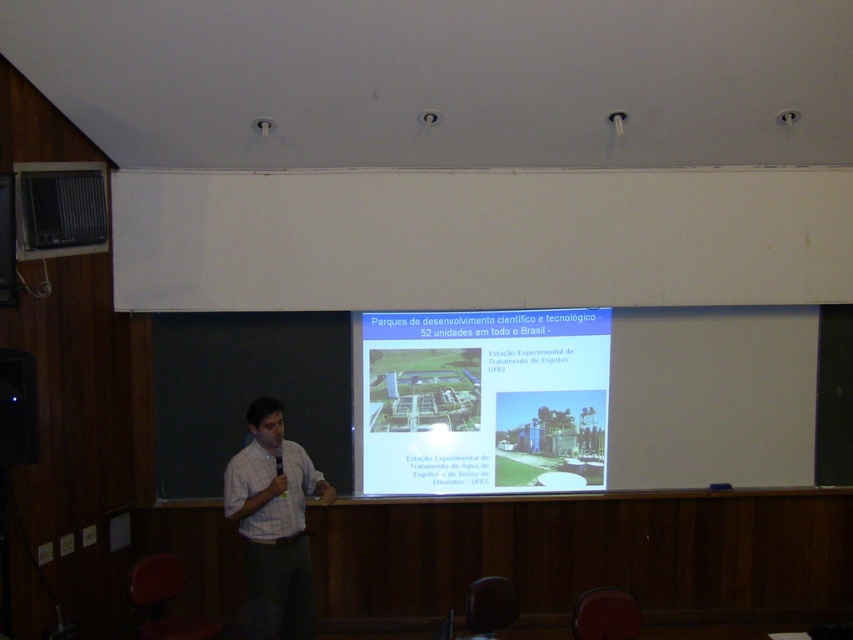
Which is below, matte black shirt at left or white shirt at center?

matte black shirt at left is below.

The image size is (853, 640). Find the location of `matte black shirt at left`. matte black shirt at left is located at coordinates (16, 408).

Does white checkered shirt at center have a lesser height compared to white shirt at center?

No.

Does white checkered shirt at center appear on the left side of white shirt at center?

Incorrect, white checkered shirt at center is not on the left side of white shirt at center.

Measure the distance between white checkered shirt at center and camera.

white checkered shirt at center and camera are 4.48 meters apart from each other.

In order to click on white checkered shirt at center in this screenshot , I will do `click(273, 524)`.

In the scene shown: Is metallic projector at upper left to the left of matte black shirt at left from the viewer's perspective?

Correct, you'll find metallic projector at upper left to the left of matte black shirt at left.

You are a GUI agent. You are given a task and a screenshot of the screen. Output one action in this format:
    pyautogui.click(x=<x>, y=<y>)
    Task: Click on the metallic projector at upper left
    The image size is (853, 640).
    Given the screenshot: What is the action you would take?
    pyautogui.click(x=61, y=209)

Does point (71, 243) lie behind point (1, 376)?

Yes, it is.

Identify the location of metallic projector at upper left. (61, 209).